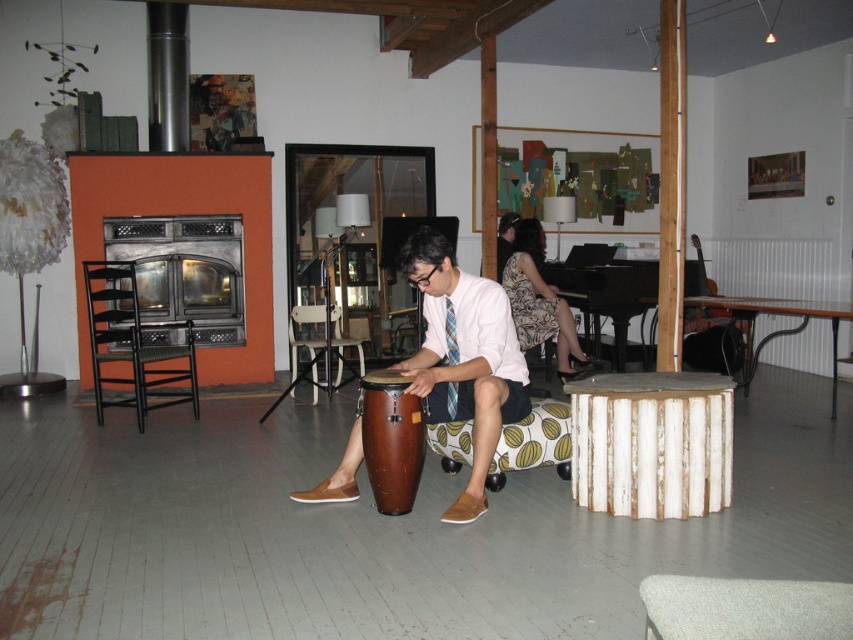
Question: Is white plastic chair at center to the right of silky blue tie at center from the viewer's perspective?

Choices:
 (A) no
 (B) yes

Answer: (A)

Question: From the image, what is the correct spatial relationship of black metal chair at left in relation to brown wooden drum at center?

Choices:
 (A) right
 (B) left

Answer: (B)

Question: Can you confirm if black metal chair at left is bigger than brown wooden drum at center?

Choices:
 (A) no
 (B) yes

Answer: (B)

Question: Which object appears farthest from the camera in this image?

Choices:
 (A) white plastic chair at center
 (B) patterned fabric dress at center
 (C) black metal chair at left
 (D) brown leather drum at center

Answer: (B)

Question: Which object is the closest to the patterned fabric dress at center?

Choices:
 (A) black metal chair at left
 (B) silky blue tie at center
 (C) white plastic chair at center
 (D) brown leather drum at center

Answer: (C)

Question: Estimate the real-world distances between objects in this image. Which object is closer to the brown leather drum at center?

Choices:
 (A) brown wooden drum at center
 (B) black metal chair at left

Answer: (A)